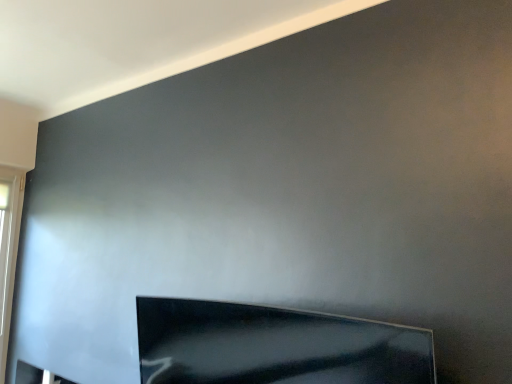
Measure the distance between point (x=172, y=359) and camera.

1.56 meters.

Image resolution: width=512 pixels, height=384 pixels. What do you see at coordinates (274, 346) in the screenshot?
I see `matte black tv at bottom` at bounding box center [274, 346].

Where is `matte black tv at bottom`? This screenshot has height=384, width=512. matte black tv at bottom is located at coordinates (274, 346).

Locate an element on the screen. matte black tv at bottom is located at coordinates (274, 346).